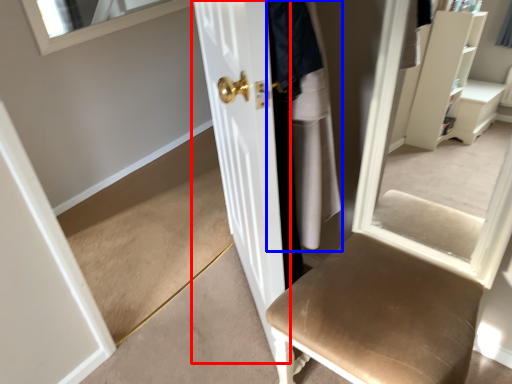
Question: Which object appears farthest to the camera in this image, door (highlighted by a red box) or clothing (highlighted by a blue box)?

Choices:
 (A) door
 (B) clothing

Answer: (B)